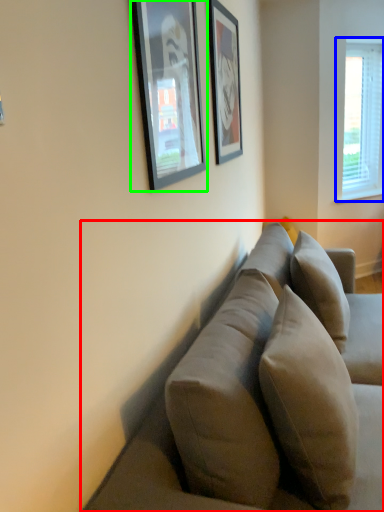
Question: Considering the real-world distances, which object is farthest from studio couch (highlighted by a red box)? window (highlighted by a blue box) or picture frame (highlighted by a green box)?

Choices:
 (A) window
 (B) picture frame

Answer: (A)